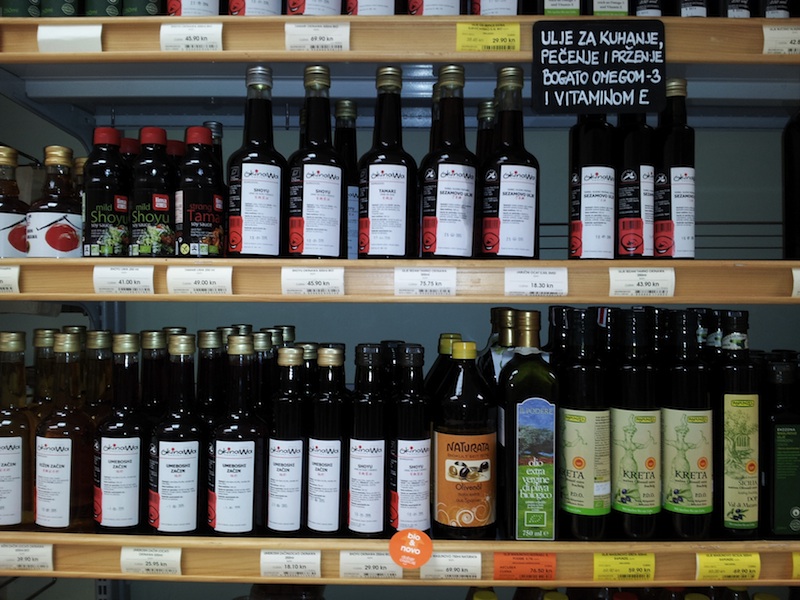
Locate an element on the screen. sticker is located at coordinates (412, 553).